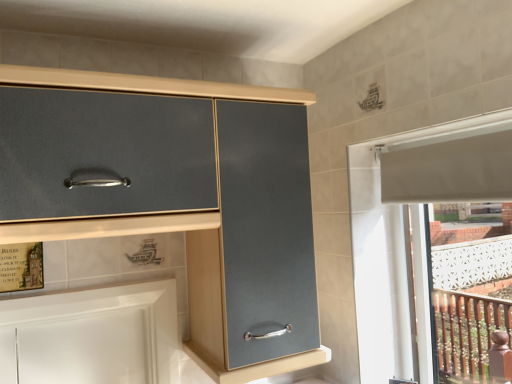
Question: From a real-world perspective, is white glossy cabinet at lower left, which is the first cabinetry from bottom to top, beneath matte gray cabinet at center, which is the second cabinetry from bottom to top?

Choices:
 (A) no
 (B) yes

Answer: (B)

Question: From the image's perspective, is white glossy cabinet at lower left, which is the first cabinetry from bottom to top, beneath matte gray cabinet at center, the 1th cabinetry viewed from the top?

Choices:
 (A) no
 (B) yes

Answer: (B)

Question: From a real-world perspective, is white glossy cabinet at lower left, which is the first cabinetry from bottom to top, over matte gray cabinet at center, which is the second cabinetry from bottom to top?

Choices:
 (A) yes
 (B) no

Answer: (B)

Question: Is white glossy cabinet at lower left, the 2th cabinetry when ordered from top to bottom, bigger than matte gray cabinet at center, the 1th cabinetry viewed from the top?

Choices:
 (A) yes
 (B) no

Answer: (B)

Question: Can you confirm if white glossy cabinet at lower left, the 2th cabinetry when ordered from top to bottom, is positioned to the left of matte gray cabinet at center, which is the second cabinetry from bottom to top?

Choices:
 (A) yes
 (B) no

Answer: (A)

Question: Is white glossy cabinet at lower left, which is the first cabinetry from bottom to top, not inside matte gray cabinet at center, the 1th cabinetry viewed from the top?

Choices:
 (A) yes
 (B) no

Answer: (A)

Question: Does matte gray cabinet at center, the 1th cabinetry viewed from the top, have a larger size compared to white glossy cabinet at lower left, the 2th cabinetry when ordered from top to bottom?

Choices:
 (A) no
 (B) yes

Answer: (B)

Question: Can you confirm if matte gray cabinet at center, the 1th cabinetry viewed from the top, is shorter than white glossy cabinet at lower left, the 2th cabinetry when ordered from top to bottom?

Choices:
 (A) yes
 (B) no

Answer: (B)

Question: Is matte gray cabinet at center, which is the second cabinetry from bottom to top, taller than white glossy cabinet at lower left, the 2th cabinetry when ordered from top to bottom?

Choices:
 (A) no
 (B) yes

Answer: (B)

Question: From a real-world perspective, is matte gray cabinet at center, the 1th cabinetry viewed from the top, on white glossy cabinet at lower left, which is the first cabinetry from bottom to top?

Choices:
 (A) yes
 (B) no

Answer: (A)

Question: Is matte gray cabinet at center, which is the second cabinetry from bottom to top, positioned far away from white glossy cabinet at lower left, which is the first cabinetry from bottom to top?

Choices:
 (A) yes
 (B) no

Answer: (B)

Question: Is matte gray cabinet at center, which is the second cabinetry from bottom to top, further to the viewer compared to white glossy cabinet at lower left, which is the first cabinetry from bottom to top?

Choices:
 (A) no
 (B) yes

Answer: (A)

Question: Considering the positions of matte gray cabinet at center, which is the second cabinetry from bottom to top, and white glossy cabinet at lower left, the 2th cabinetry when ordered from top to bottom, in the image, is matte gray cabinet at center, which is the second cabinetry from bottom to top, taller or shorter than white glossy cabinet at lower left, the 2th cabinetry when ordered from top to bottom,?

Choices:
 (A) tall
 (B) short

Answer: (A)